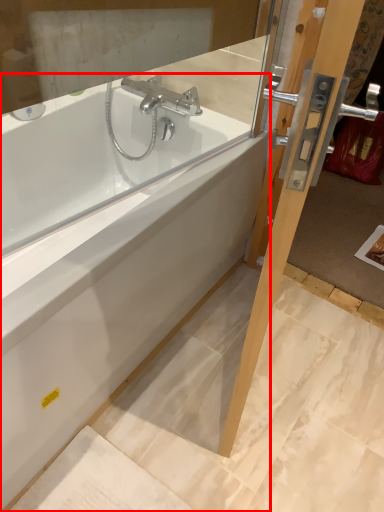
Question: In this image, where is bathtub (annotated by the red box) located relative to screen door?

Choices:
 (A) left
 (B) right

Answer: (A)